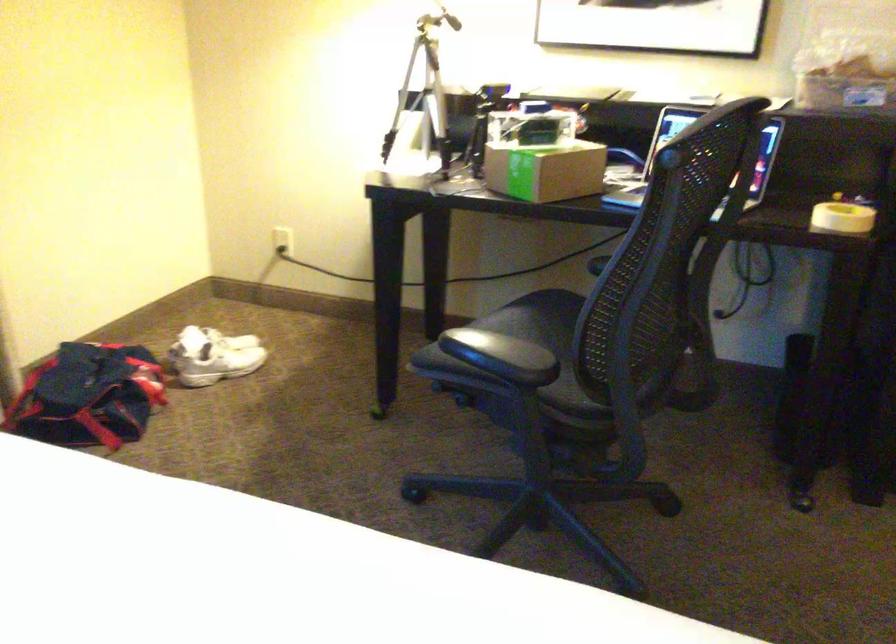
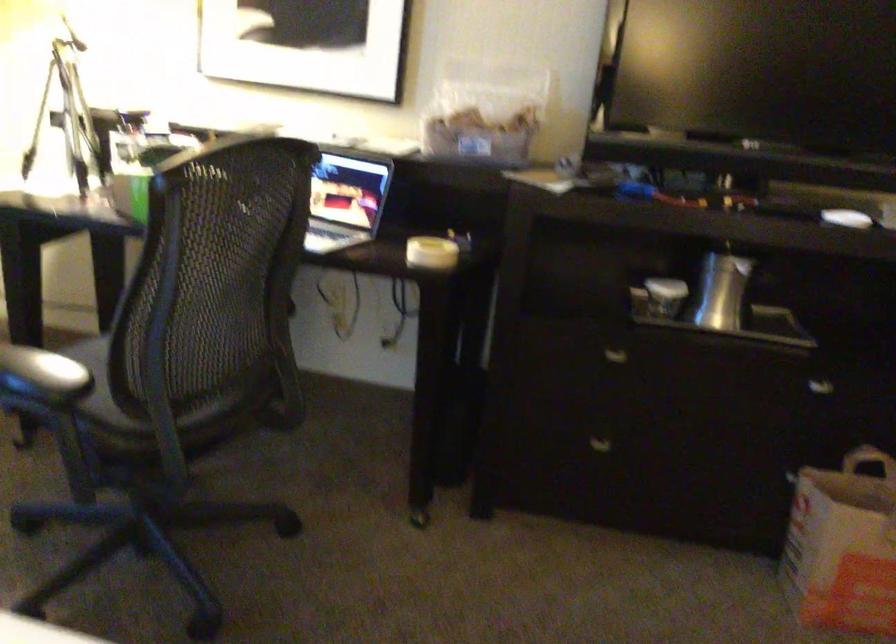
Question: I am providing you with two images of the same scene from different viewpoints. After the viewpoint changes to image2, which objects are now occluded?

Choices:
 (A) white lidded cup
 (B) white roll of tape
 (C) bed frame armrest
 (D) chair sitting surface

Answer: (D)